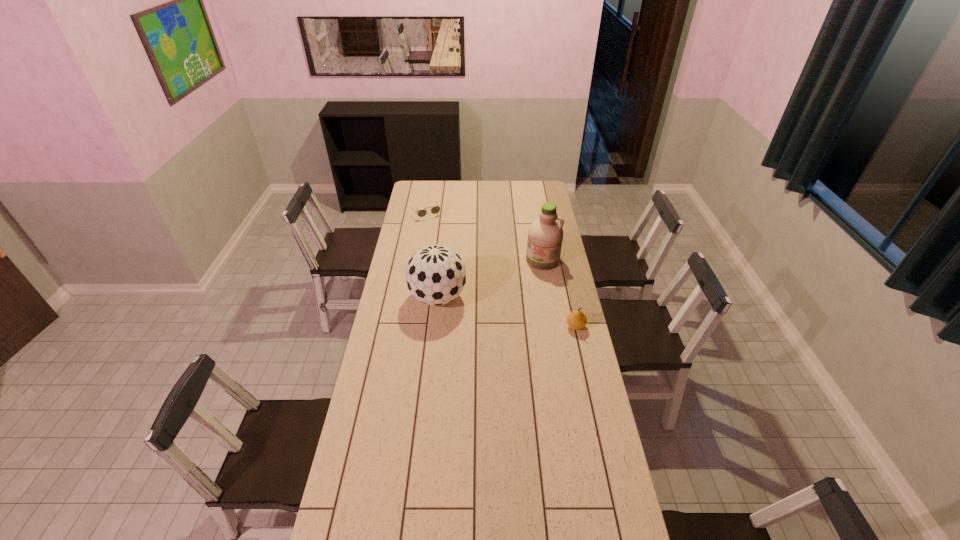
Where is `vacant space in between the second farthest object and the third farthest object`? The height and width of the screenshot is (540, 960). vacant space in between the second farthest object and the third farthest object is located at coordinates (491, 279).

Where is `blank region between the second shortest object and the shortest object`? blank region between the second shortest object and the shortest object is located at coordinates (500, 269).

Identify the location of free space between the cleansing agent and the farthest object. (484, 237).

This screenshot has width=960, height=540. What are the coordinates of `vacant area that lies between the third shortest object and the pear` in the screenshot? It's located at (507, 312).

Locate which object is the third closest to the nearest object. Please provide its 2D coordinates. Your answer should be formatted as a tuple, i.e. [(x, y)], where the tuple contains the x and y coordinates of a point satisfying the conditions above.

[(434, 210)]

Choose which object is the second nearest neighbor to the tallest object. Please provide its 2D coordinates. Your answer should be formatted as a tuple, i.e. [(x, y)], where the tuple contains the x and y coordinates of a point satisfying the conditions above.

[(576, 320)]

Identify the location of free spot that satisfies the following two spatial constraints: 1. on the front side of the third farthest object; 2. on the left side of the shortest object. The image size is (960, 540). (411, 298).

The height and width of the screenshot is (540, 960). Find the location of `free space in the image that satisfies the following two spatial constraints: 1. on the front side of the nearest object; 2. on the right side of the soccer ball`. free space in the image that satisfies the following two spatial constraints: 1. on the front side of the nearest object; 2. on the right side of the soccer ball is located at coordinates (435, 326).

You are a GUI agent. You are given a task and a screenshot of the screen. Output one action in this format:
    pyautogui.click(x=<x>, y=<y>)
    Task: Click on the vacant point that satisfies the following two spatial constraints: 1. on the front side of the tallest object; 2. on the right side of the shortest object
    The height and width of the screenshot is (540, 960).
    Given the screenshot: What is the action you would take?
    pyautogui.click(x=418, y=260)

Identify the location of vacant space that satisfies the following two spatial constraints: 1. on the back side of the third nearest object; 2. on the left side of the third shortest object. The width and height of the screenshot is (960, 540). (442, 260).